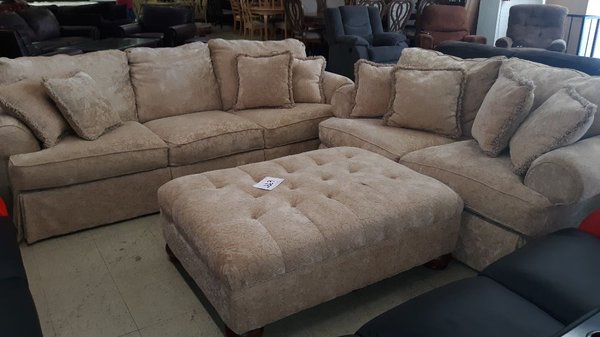
This screenshot has width=600, height=337. Find the location of `grey chair`. grey chair is located at coordinates (530, 25).